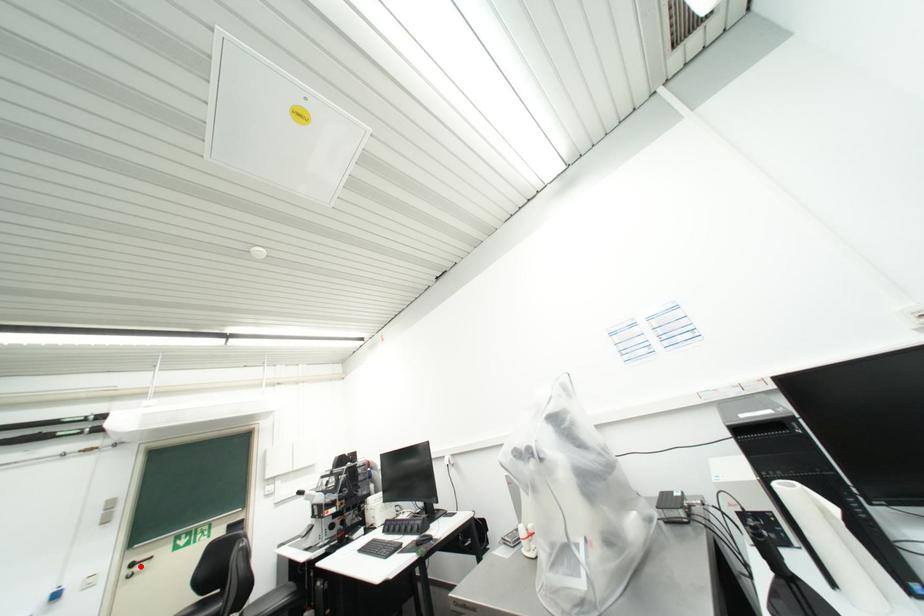
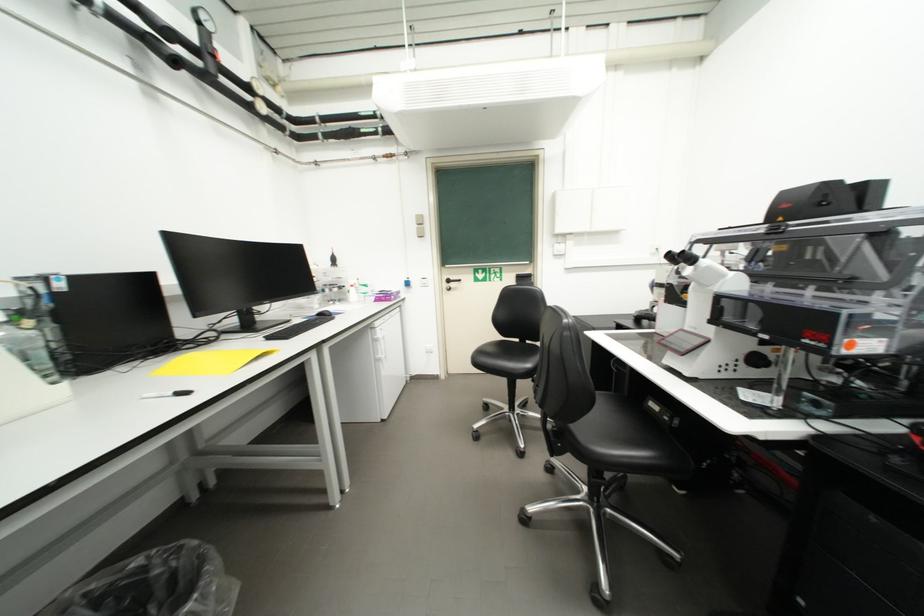
Question: I am providing you with two images of the same scene from different viewpoints. Image1 has a red point marked. In image2, the corresponding 3D location appears at what relative position? Reply with the corresponding letter.

Choices:
 (A) Closer
 (B) Farther

Answer: (B)